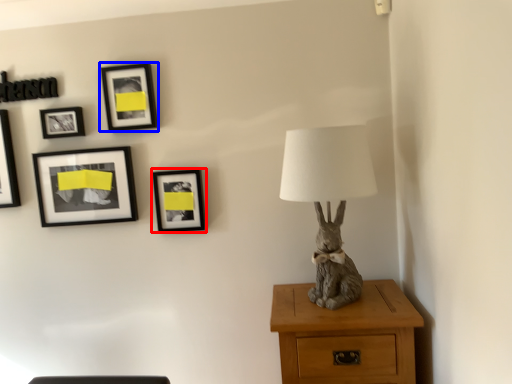
Question: Which object appears farthest to the camera in this image, picture frame (highlighted by a red box) or picture frame (highlighted by a blue box)?

Choices:
 (A) picture frame
 (B) picture frame

Answer: (A)